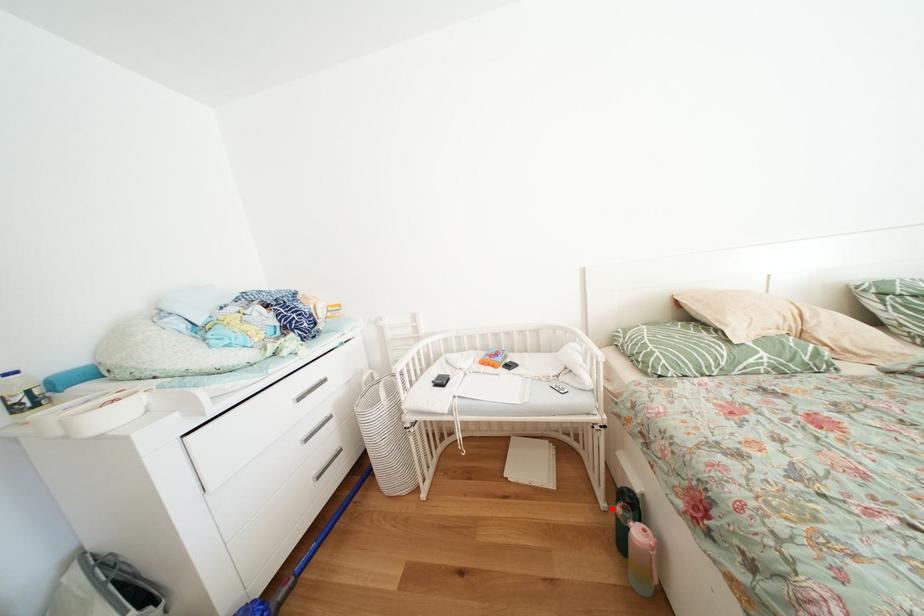
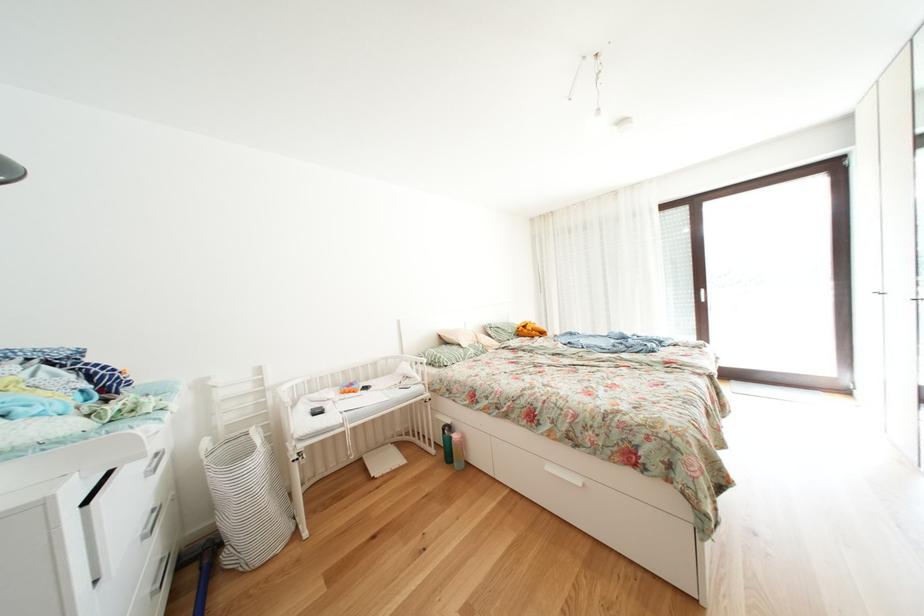
The point at the highlighted location is marked in the first image. Where is the corresponding point in the second image?

(443, 456)